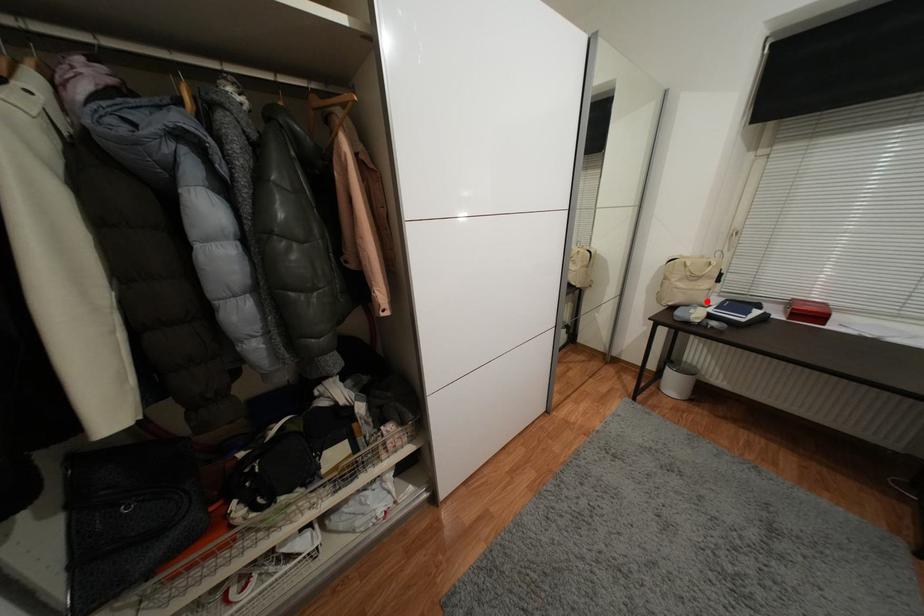
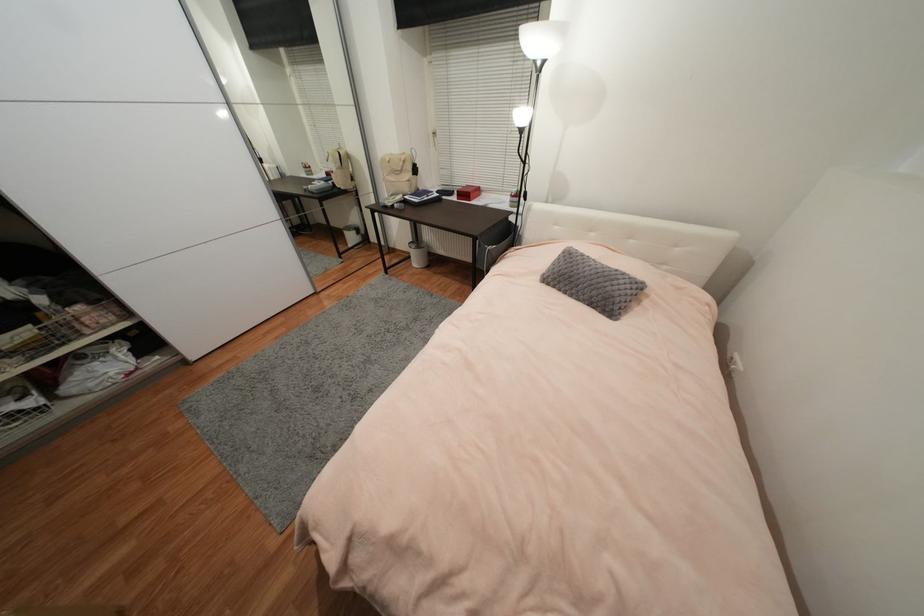
Question: I am providing you with two images of the same scene from different viewpoints. In image1, a red point is highlighted. Considering the same 3D point in image2, which of the following is correct?

Choices:
 (A) It is closer
 (B) It is farther

Answer: (A)